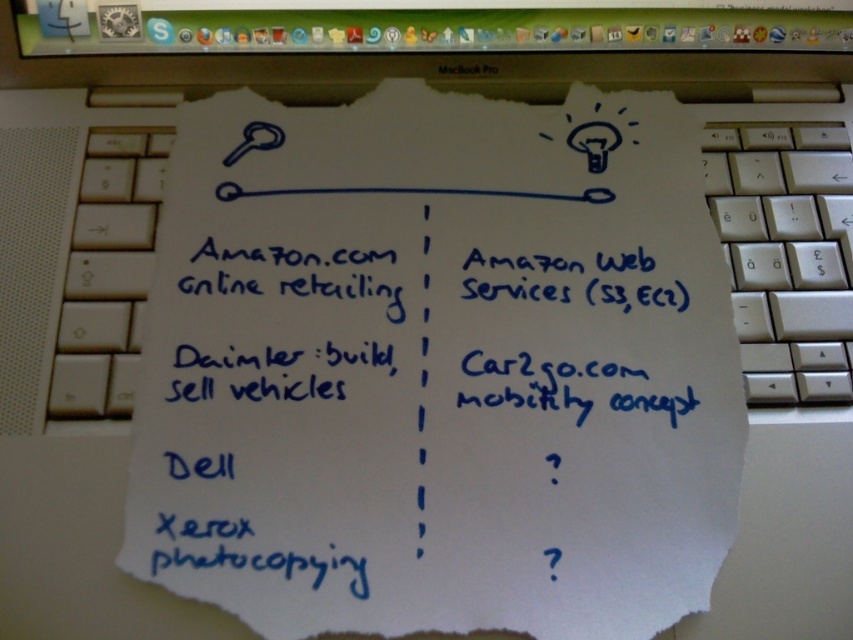
Question: Does black glossy computer screen at upper center have a lesser width compared to white plastic keyboard at right?

Choices:
 (A) no
 (B) yes

Answer: (A)

Question: Can you confirm if black glossy computer screen at upper center is positioned below white plastic keyboard at right?

Choices:
 (A) yes
 (B) no

Answer: (B)

Question: In this image, where is black glossy computer screen at upper center located relative to white plastic keyboard at right?

Choices:
 (A) left
 (B) right

Answer: (A)